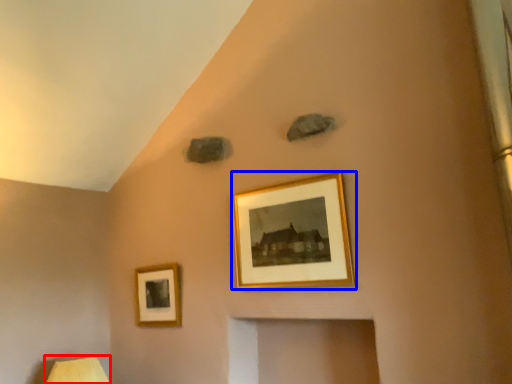
Question: Which object appears closest to the camera in this image, table lamp (highlighted by a red box) or picture frame (highlighted by a blue box)?

Choices:
 (A) table lamp
 (B) picture frame

Answer: (B)